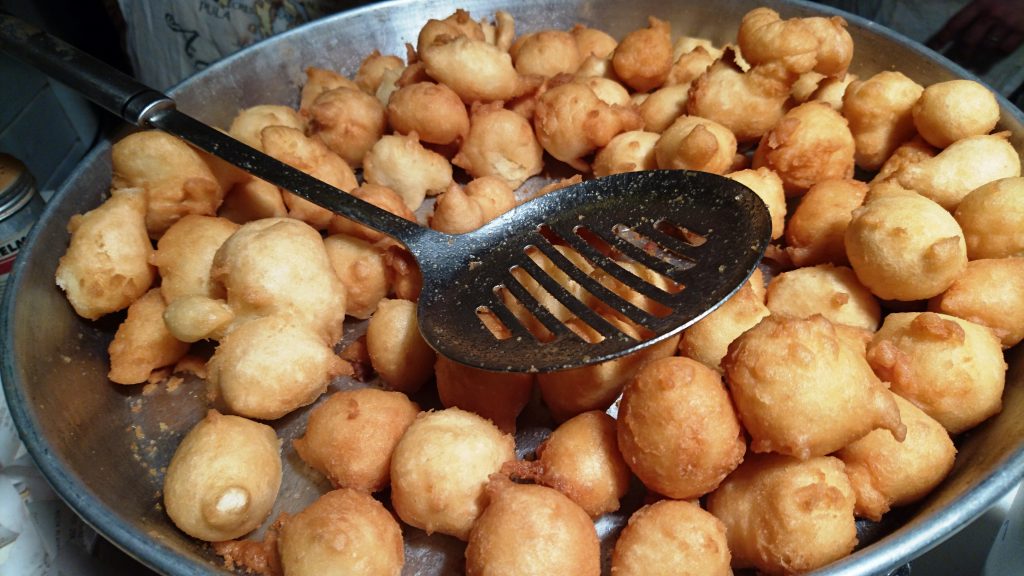
The height and width of the screenshot is (576, 1024). Identify the location of handle. (105, 90).